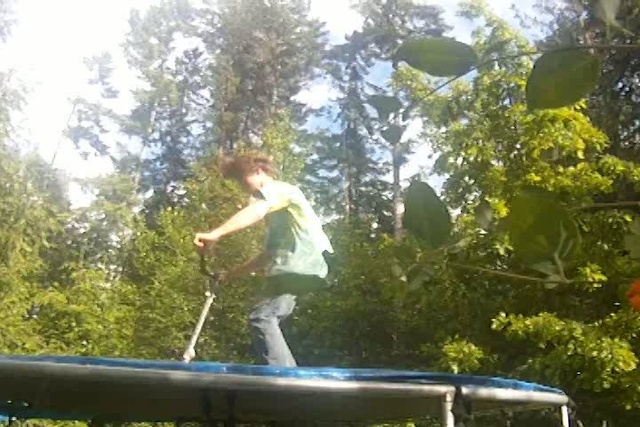
Find the location of a particular element. This screenshot has width=640, height=427. handle is located at coordinates (200, 260).